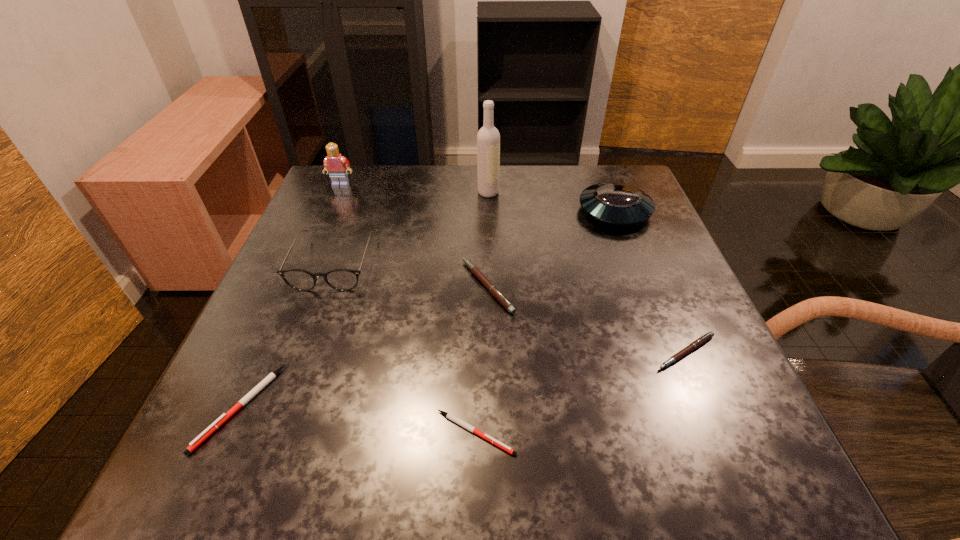
The height and width of the screenshot is (540, 960). Find the location of `vacant area that lies between the vodka and the saucer`. vacant area that lies between the vodka and the saucer is located at coordinates (551, 202).

Image resolution: width=960 pixels, height=540 pixels. In order to click on empty space that is in between the rightmost pen and the vodka in this screenshot , I will do (587, 272).

Locate an element on the screen. vacant space that is in between the left pink pen and the black spectacles is located at coordinates (411, 274).

Identify the location of unoccupied position between the smaller white pen and the second tallest object. (408, 309).

The width and height of the screenshot is (960, 540). Identify the location of free space between the saucer and the white vodka. (551, 202).

Image resolution: width=960 pixels, height=540 pixels. Identify the location of free space that is in between the rightmost pen and the gray saucer. (650, 281).

Where is `empty location between the black spectacles and the saucer`? empty location between the black spectacles and the saucer is located at coordinates coord(474,237).

This screenshot has width=960, height=540. What are the coordinates of `free space between the spectacles and the white vodka` in the screenshot? It's located at (411, 227).

Where is `the fourth closest object to the white vodka`? The width and height of the screenshot is (960, 540). the fourth closest object to the white vodka is located at coordinates (335, 164).

The image size is (960, 540). Find the location of `the sixth closest object to the rightmost pen`. the sixth closest object to the rightmost pen is located at coordinates (224, 417).